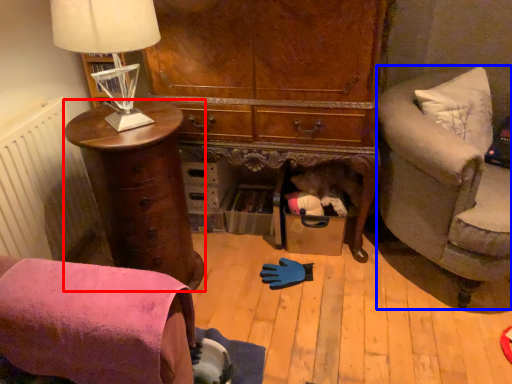
Question: Among these objects, which one is nearest to the camera, chest of drawers (highlighted by a red box) or studio couch (highlighted by a blue box)?

Choices:
 (A) chest of drawers
 (B) studio couch

Answer: (B)